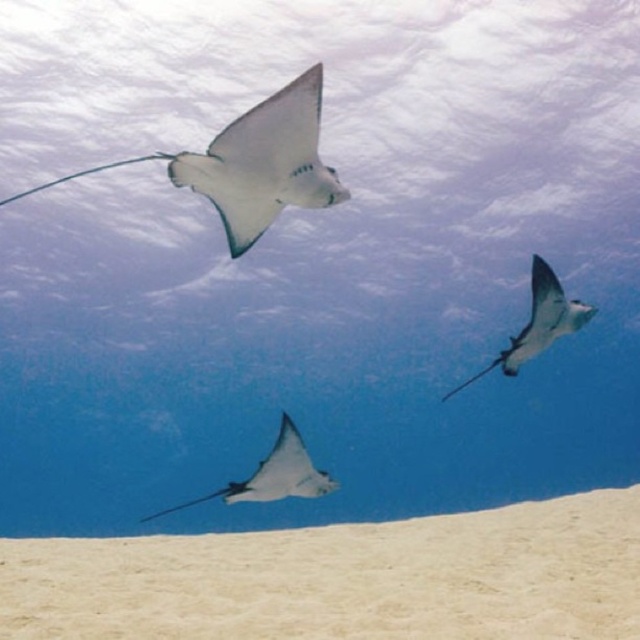
Can you confirm if white sandy bottom at lower center is positioned below translucent white stingray at upper center?

Yes.

Can you confirm if white sandy bottom at lower center is positioned to the left of translucent white stingray at upper center?

Correct, you'll find white sandy bottom at lower center to the left of translucent white stingray at upper center.

Find the location of a particular element. Image resolution: width=640 pixels, height=640 pixels. white sandy bottom at lower center is located at coordinates (342, 579).